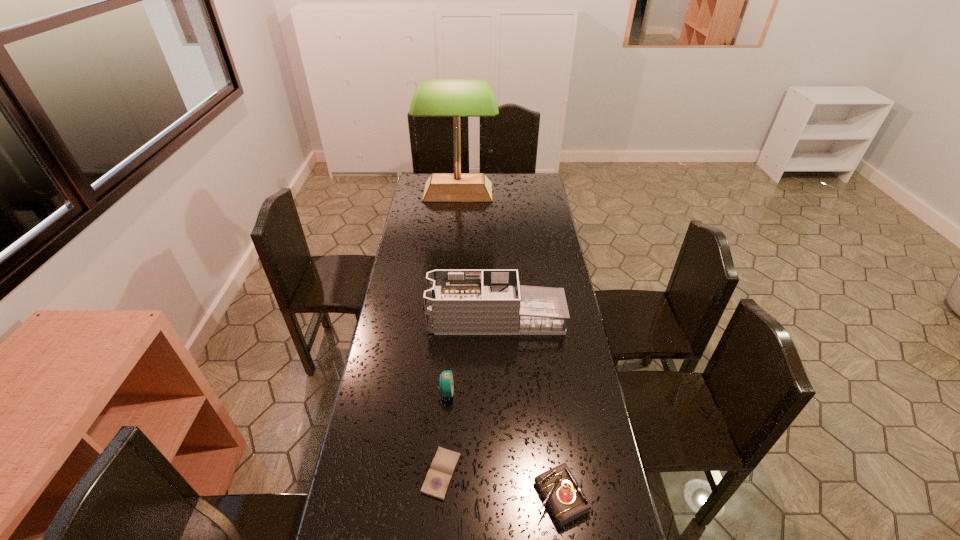
This screenshot has height=540, width=960. In the image, there is a desktop. Find the location of `free space at the left edge`. free space at the left edge is located at coordinates pyautogui.click(x=389, y=366).

In order to click on vacant position at the right edge of the desktop in this screenshot , I will do `click(556, 236)`.

Locate an element on the screen. Image resolution: width=960 pixels, height=540 pixels. vacant space at the far left corner of the desktop is located at coordinates (423, 182).

Image resolution: width=960 pixels, height=540 pixels. Identify the location of free region at the far right corner of the desktop. (520, 191).

This screenshot has height=540, width=960. What are the coordinates of `vacant space that is in between the right diary and the table lamp` in the screenshot? It's located at (510, 345).

This screenshot has width=960, height=540. What are the coordinates of `free space between the fourth tallest object and the left diary` in the screenshot? It's located at tap(501, 485).

You are a GUI agent. You are given a task and a screenshot of the screen. Output one action in this format:
    pyautogui.click(x=<x>, y=<y>)
    Task: Click on the free space that is in between the right diary and the third tallest object
    
    Given the screenshot: What is the action you would take?
    pos(504,444)

This screenshot has width=960, height=540. What are the coordinates of `unoccupied area between the second tallest object and the taller diary` in the screenshot? It's located at (529, 408).

Locate an element on the screen. The image size is (960, 540). free space between the fourth shortest object and the shorter diary is located at coordinates (468, 396).

In order to click on vacant area that lies between the shortest object and the dollhouse in this screenshot , I will do `click(468, 396)`.